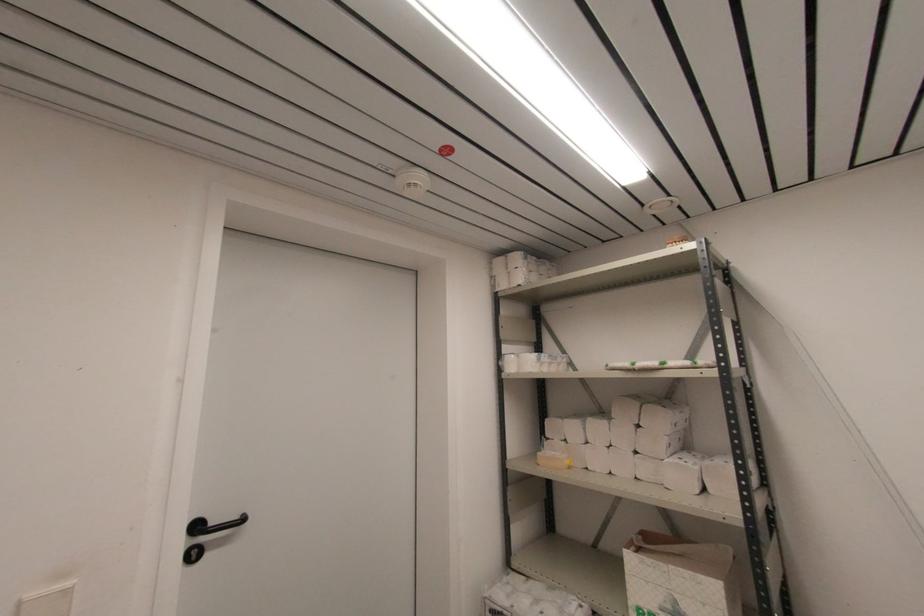
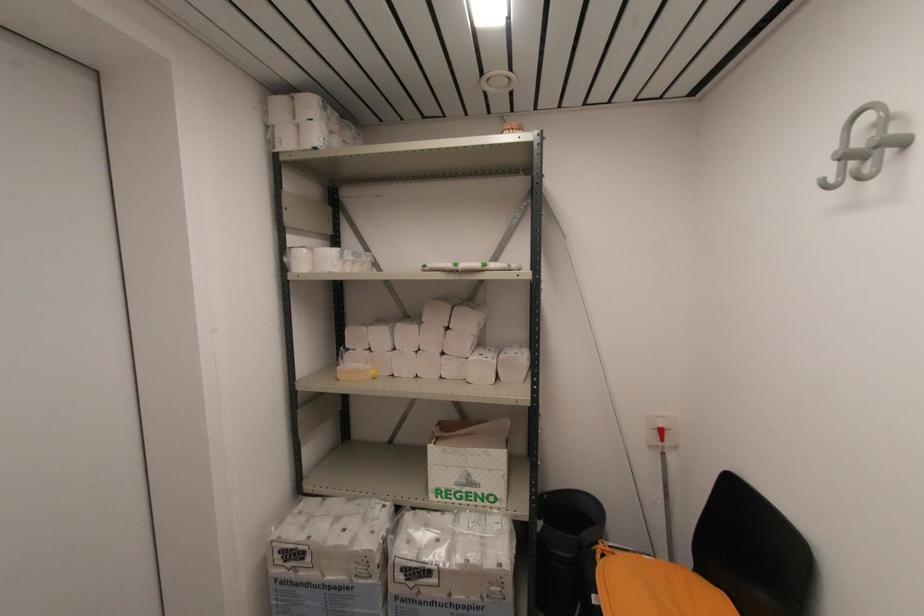
Locate, in the second image, the point that corresponds to pixel 517 286 in the first image.

(310, 148)